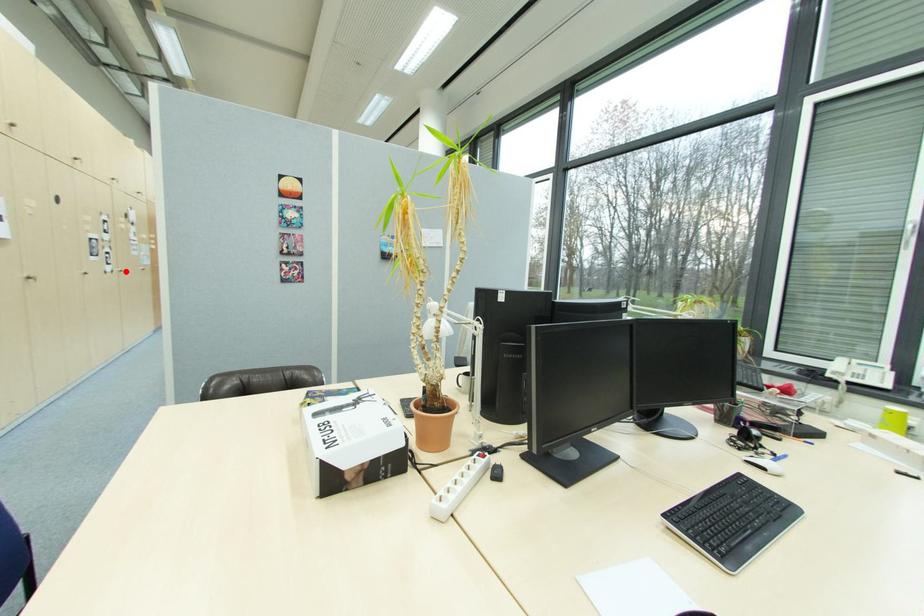
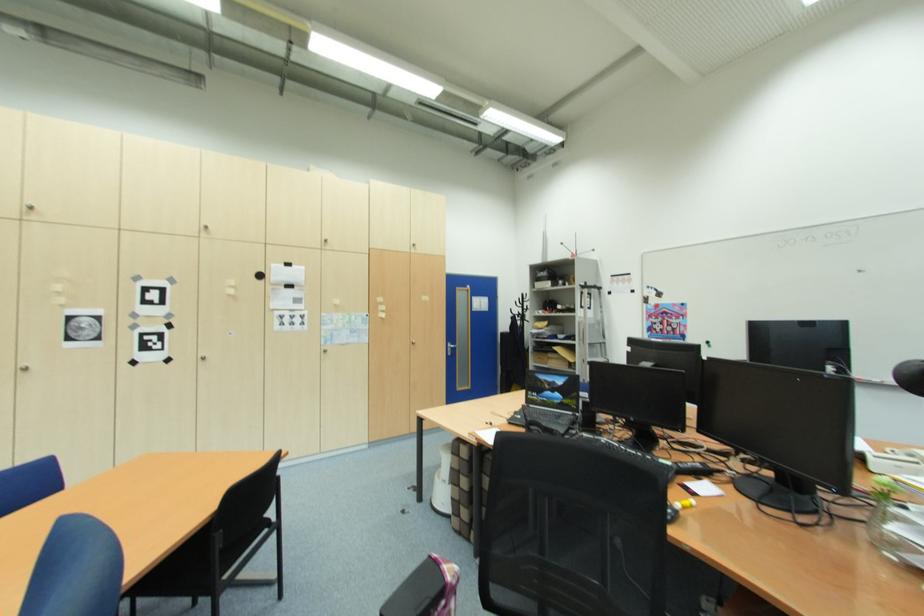
Find the pixel in the second image that matches the highlighted location in the first image.

(208, 360)